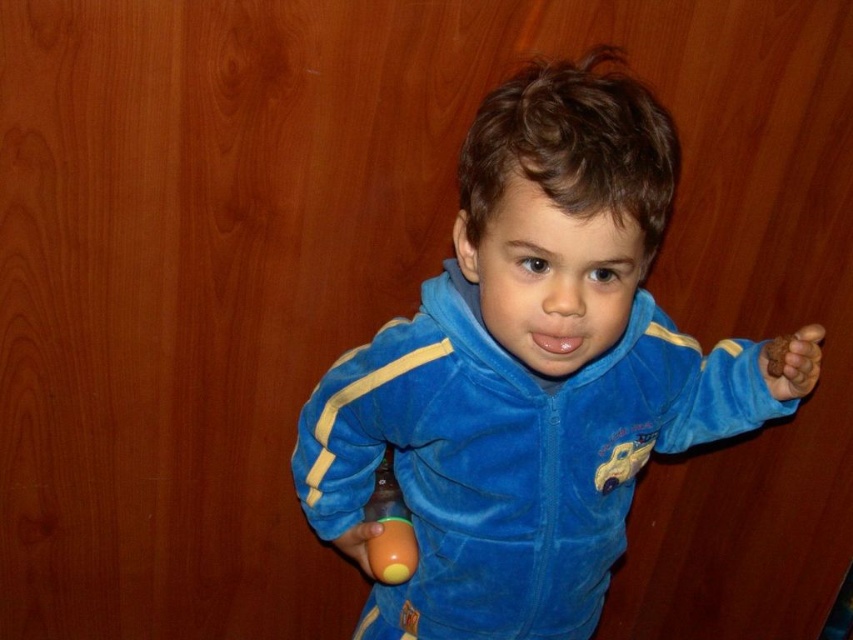
Does velvet blue tracksuit at center have a smaller size compared to matte orange ball at lower center?

No.

Between point (604, 344) and point (367, 554), which one is positioned behind?

Point (367, 554)

Locate an element on the screen. This screenshot has height=640, width=853. velvet blue tracksuit at center is located at coordinates (527, 372).

Is point (380, 524) positioned behind point (352, 540)?

That is False.

The width and height of the screenshot is (853, 640). Identify the location of orange rubber ball at lower center. (389, 528).

What do you see at coordinates (389, 528) in the screenshot? This screenshot has height=640, width=853. I see `orange rubber ball at lower center` at bounding box center [389, 528].

This screenshot has width=853, height=640. I want to click on orange rubber ball at lower center, so tap(389, 528).

Is point (386, 582) closer to camera compared to point (815, 364)?

No, it is behind (815, 364).

Is the position of orange rubber ball at lower center more distant than that of brown matte hand at right?

Yes, it is.

This screenshot has height=640, width=853. What do you see at coordinates (389, 528) in the screenshot? I see `orange rubber ball at lower center` at bounding box center [389, 528].

Identify the location of orange rubber ball at lower center. (389, 528).